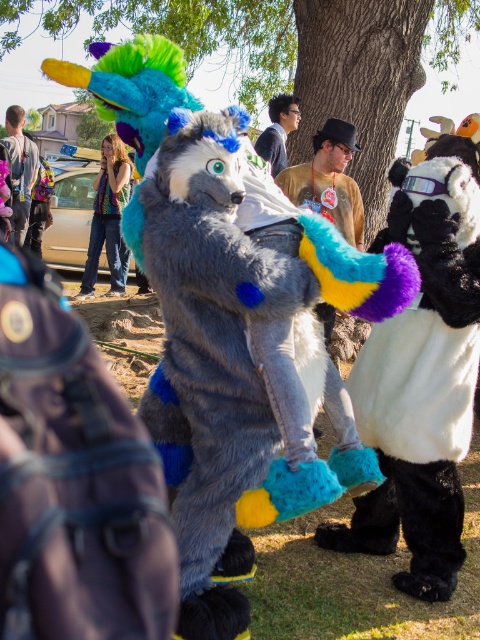
Question: Does white fluffy costume at right lie in front of matte gray fur at center?

Choices:
 (A) no
 (B) yes

Answer: (B)

Question: Among these objects, which one is farthest from the camera?

Choices:
 (A) fluffy fur costume at center
 (B) matte black backpack at left
 (C) fuzzy gray wolf at center
 (D) white fluffy costume at right

Answer: (B)

Question: Which point appears farthest from the camera in this image?

Choices:
 (A) (317, 314)
 (B) (263, 132)
 (C) (104, 227)
 (D) (427, 268)

Answer: (C)

Question: Does fluffy fur costume at center appear on the left side of matte gray fur at center?

Choices:
 (A) yes
 (B) no

Answer: (B)

Question: Among these objects, which one is farthest from the camera?

Choices:
 (A) fluffy fur costume at center
 (B) denim jeans at center

Answer: (B)

Question: Does white fluffy costume at right appear on the right side of fuzzy gray wolf at center?

Choices:
 (A) yes
 (B) no

Answer: (A)